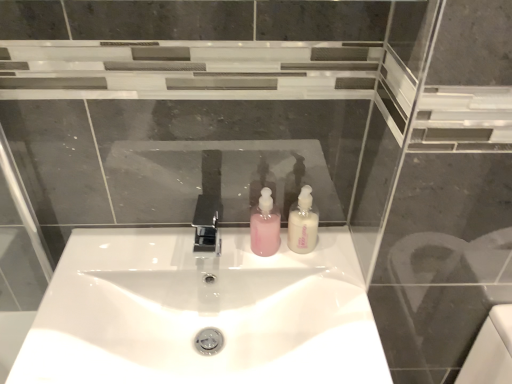
Identify the location of white glossy soap dispenser at center, the 2th soap dispenser in the left-to-right sequence. Image resolution: width=512 pixels, height=384 pixels. (303, 223).

This screenshot has width=512, height=384. What do you see at coordinates (265, 225) in the screenshot? I see `pink matte soap dispenser at center, the second soap dispenser when ordered from right to left` at bounding box center [265, 225].

Describe the element at coordinates (202, 313) in the screenshot. I see `white glossy sink at center` at that location.

Identify the location of white glossy soap dispenser at center, the 2th soap dispenser in the left-to-right sequence. The width and height of the screenshot is (512, 384). (303, 223).

Consider the image. Which of these two, white glossy sink at center or polished chrome tap at center, is wider?

white glossy sink at center.

At what (x,y) coordinates should I click in order to perform the action: click on sink that appears on the right of polished chrome tap at center. Please return your answer as a coordinate pair (x, y). Image resolution: width=512 pixels, height=384 pixels. Looking at the image, I should click on (202, 313).

Is white glossy sink at center inside or outside of polished chrome tap at center?

white glossy sink at center is outside polished chrome tap at center.

From a real-world perspective, is white glossy soap dispenser at center, the 2th soap dispenser in the left-to-right sequence, positioned over polished chrome tap at center based on gravity?

Correct, in the physical world, white glossy soap dispenser at center, the 2th soap dispenser in the left-to-right sequence, is higher than polished chrome tap at center.

Who is smaller, white glossy soap dispenser at center, the 2th soap dispenser in the left-to-right sequence, or polished chrome tap at center?

With smaller size is white glossy soap dispenser at center, the 2th soap dispenser in the left-to-right sequence.

Is point (307, 209) closer to viewer compared to point (195, 212)?

That is True.

Is white glossy soap dispenser at center, the first soap dispenser from the right, next to polished chrome tap at center and touching it?

No, white glossy soap dispenser at center, the first soap dispenser from the right, is not next to polished chrome tap at center.

Considering the relative positions of white glossy soap dispenser at center, the 2th soap dispenser in the left-to-right sequence, and white glossy sink at center in the image provided, is white glossy soap dispenser at center, the 2th soap dispenser in the left-to-right sequence, to the right of white glossy sink at center from the viewer's perspective?

Indeed, white glossy soap dispenser at center, the 2th soap dispenser in the left-to-right sequence, is positioned on the right side of white glossy sink at center.

Is white glossy soap dispenser at center, the first soap dispenser from the right, beside white glossy sink at center?

No, white glossy soap dispenser at center, the first soap dispenser from the right, is not with white glossy sink at center.

How different are the orientations of white glossy soap dispenser at center, the 2th soap dispenser in the left-to-right sequence, and white glossy sink at center in degrees?

0.207 degrees.

Is the position of white glossy soap dispenser at center, the 2th soap dispenser in the left-to-right sequence, more distant than that of white glossy sink at center?

Yes, white glossy soap dispenser at center, the 2th soap dispenser in the left-to-right sequence, is further from the camera.

Is white glossy sink at center oriented away from pink matte soap dispenser at center, which appears as the first soap dispenser when viewed from the left?

No, white glossy sink at center is not facing the opposite direction of pink matte soap dispenser at center, which appears as the first soap dispenser when viewed from the left.

How different are the orientations of white glossy sink at center and pink matte soap dispenser at center, which appears as the first soap dispenser when viewed from the left, in degrees?

The angular difference between white glossy sink at center and pink matte soap dispenser at center, which appears as the first soap dispenser when viewed from the left, is 0.38 degrees.

Who is taller, white glossy sink at center or pink matte soap dispenser at center, which appears as the first soap dispenser when viewed from the left?

white glossy sink at center.

Which is more distant, (340, 315) or (251, 215)?

Point (251, 215)

In terms of size, does pink matte soap dispenser at center, which appears as the first soap dispenser when viewed from the left, appear bigger or smaller than white glossy sink at center?

In the image, pink matte soap dispenser at center, which appears as the first soap dispenser when viewed from the left, appears to be smaller than white glossy sink at center.

Which object is more forward, pink matte soap dispenser at center, the second soap dispenser when ordered from right to left, or white glossy sink at center?

white glossy sink at center is in front.

Is pink matte soap dispenser at center, the second soap dispenser when ordered from right to left, inside the boundaries of white glossy sink at center, or outside?

pink matte soap dispenser at center, the second soap dispenser when ordered from right to left, is not enclosed by white glossy sink at center.

Based on the photo, would you say pink matte soap dispenser at center, which appears as the first soap dispenser when viewed from the left, is to the left or to the right of white glossy sink at center in the picture?

pink matte soap dispenser at center, which appears as the first soap dispenser when viewed from the left, is positioned on white glossy sink at center's right side.

Based on their sizes in the image, would you say pink matte soap dispenser at center, the second soap dispenser when ordered from right to left, is bigger or smaller than white glossy soap dispenser at center, the first soap dispenser from the right?

pink matte soap dispenser at center, the second soap dispenser when ordered from right to left, is bigger than white glossy soap dispenser at center, the first soap dispenser from the right.

Between pink matte soap dispenser at center, which appears as the first soap dispenser when viewed from the left, and white glossy soap dispenser at center, the first soap dispenser from the right, which one is positioned in front?

Positioned in front is white glossy soap dispenser at center, the first soap dispenser from the right.

Between pink matte soap dispenser at center, the second soap dispenser when ordered from right to left, and white glossy soap dispenser at center, the 2th soap dispenser in the left-to-right sequence, which one has larger width?

pink matte soap dispenser at center, the second soap dispenser when ordered from right to left.

Is pink matte soap dispenser at center, which appears as the first soap dispenser when viewed from the left, positioned with its back to white glossy soap dispenser at center, the first soap dispenser from the right?

That's not correct — pink matte soap dispenser at center, which appears as the first soap dispenser when viewed from the left, is not looking away from white glossy soap dispenser at center, the first soap dispenser from the right.

Is white glossy soap dispenser at center, the first soap dispenser from the right, looking in the opposite direction of pink matte soap dispenser at center, the second soap dispenser when ordered from right to left?

white glossy soap dispenser at center, the first soap dispenser from the right, is not turned away from pink matte soap dispenser at center, the second soap dispenser when ordered from right to left.

Relative to pink matte soap dispenser at center, the second soap dispenser when ordered from right to left, is white glossy soap dispenser at center, the 2th soap dispenser in the left-to-right sequence, in front or behind?

white glossy soap dispenser at center, the 2th soap dispenser in the left-to-right sequence, is positioned closer to the viewer than pink matte soap dispenser at center, the second soap dispenser when ordered from right to left.

Between white glossy soap dispenser at center, the 2th soap dispenser in the left-to-right sequence, and pink matte soap dispenser at center, the second soap dispenser when ordered from right to left, which one appears on the left side from the viewer's perspective?

pink matte soap dispenser at center, the second soap dispenser when ordered from right to left.

Between white glossy soap dispenser at center, the first soap dispenser from the right, and pink matte soap dispenser at center, the second soap dispenser when ordered from right to left, which one has larger width?

With larger width is pink matte soap dispenser at center, the second soap dispenser when ordered from right to left.

Find the location of a particular element. This screenshot has width=512, height=384. sink that is on the right side of polished chrome tap at center is located at coordinates (202, 313).

This screenshot has height=384, width=512. I want to click on the 1st soap dispenser behind the polished chrome tap at center, counting from the anchor's position, so click(303, 223).

Consider the image. Looking at the image, which one is located further to white glossy sink at center, pink matte soap dispenser at center, the second soap dispenser when ordered from right to left, or polished chrome tap at center?

pink matte soap dispenser at center, the second soap dispenser when ordered from right to left, is positioned further to the anchor white glossy sink at center.

From the image, which object appears to be farther from polished chrome tap at center, pink matte soap dispenser at center, the second soap dispenser when ordered from right to left, or white glossy soap dispenser at center, the first soap dispenser from the right?

Among the two, white glossy soap dispenser at center, the first soap dispenser from the right, is located further to polished chrome tap at center.

Estimate the real-world distances between objects in this image. Which object is further from white glossy sink at center, polished chrome tap at center or pink matte soap dispenser at center, the second soap dispenser when ordered from right to left?

pink matte soap dispenser at center, the second soap dispenser when ordered from right to left, is positioned further to the anchor white glossy sink at center.

Looking at the image, which one is located closer to polished chrome tap at center, white glossy soap dispenser at center, the first soap dispenser from the right, or white glossy sink at center?

white glossy soap dispenser at center, the first soap dispenser from the right, lies closer to polished chrome tap at center than the other object.

Looking at the image, which one is located further to polished chrome tap at center, white glossy sink at center or white glossy soap dispenser at center, the first soap dispenser from the right?

white glossy sink at center is further to polished chrome tap at center.

Which object lies nearer to the anchor point pink matte soap dispenser at center, which appears as the first soap dispenser when viewed from the left, white glossy sink at center or white glossy soap dispenser at center, the first soap dispenser from the right?

The object closer to pink matte soap dispenser at center, which appears as the first soap dispenser when viewed from the left, is white glossy soap dispenser at center, the first soap dispenser from the right.

From the image, which object appears to be nearer to white glossy sink at center, white glossy soap dispenser at center, the 2th soap dispenser in the left-to-right sequence, or polished chrome tap at center?

The object closer to white glossy sink at center is polished chrome tap at center.

Estimate the real-world distances between objects in this image. Which object is further from pink matte soap dispenser at center, which appears as the first soap dispenser when viewed from the left, white glossy sink at center or polished chrome tap at center?

Among the two, white glossy sink at center is located further to pink matte soap dispenser at center, which appears as the first soap dispenser when viewed from the left.

Image resolution: width=512 pixels, height=384 pixels. What are the coordinates of `sink between polished chrome tap at center and white glossy soap dispenser at center, the 2th soap dispenser in the left-to-right sequence, from left to right` in the screenshot? It's located at (202, 313).

You are a GUI agent. You are given a task and a screenshot of the screen. Output one action in this format:
    pyautogui.click(x=<x>, y=<y>)
    Task: Click on the soap dispenser between white glossy soap dispenser at center, the 2th soap dispenser in the left-to-right sequence, and white glossy sink at center from top to bottom
    
    Given the screenshot: What is the action you would take?
    pyautogui.click(x=265, y=225)

You are a GUI agent. You are given a task and a screenshot of the screen. Output one action in this format:
    pyautogui.click(x=<x>, y=<y>)
    Task: Click on the soap dispenser between polished chrome tap at center and white glossy soap dispenser at center, the 2th soap dispenser in the left-to-right sequence, in the horizontal direction
    
    Given the screenshot: What is the action you would take?
    [265, 225]

Find the location of `tap between pink matte soap dispenser at center, which appears as the first soap dispenser when viewed from the left, and white glossy sink at center, in the vertical direction`. tap between pink matte soap dispenser at center, which appears as the first soap dispenser when viewed from the left, and white glossy sink at center, in the vertical direction is located at coordinates (207, 223).